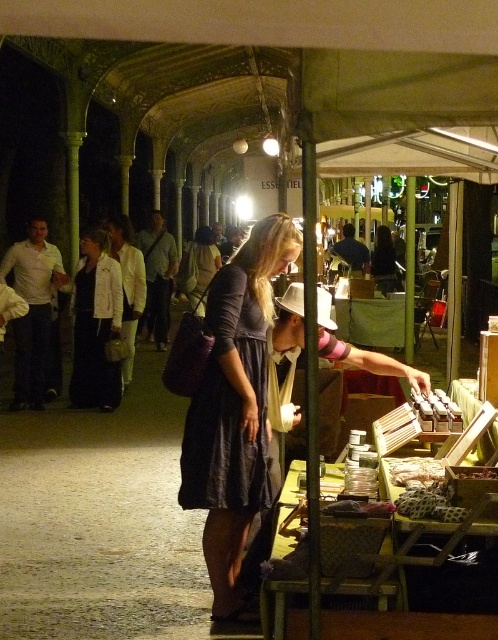
Question: Can you confirm if dark gray dress at center is thinner than dark blue fabric dress at center?

Choices:
 (A) no
 (B) yes

Answer: (A)

Question: Which of the following is the farthest from the observer?

Choices:
 (A) dark blue fabric dress at center
 (B) dark gray dress at center

Answer: (B)

Question: Estimate the real-world distances between objects in this image. Which object is farther from the matte black dress at center?

Choices:
 (A) dark gray dress at center
 (B) dark blue fabric dress at center

Answer: (B)

Question: Does dark gray dress at center appear on the left side of matte black dress at center?

Choices:
 (A) no
 (B) yes

Answer: (A)

Question: From the image, what is the correct spatial relationship of dark gray dress at center in relation to matte black dress at center?

Choices:
 (A) below
 (B) above

Answer: (A)

Question: Which point appears closest to the camera in this image?

Choices:
 (A) (251, 445)
 (B) (120, 307)
 (C) (300, 248)

Answer: (A)